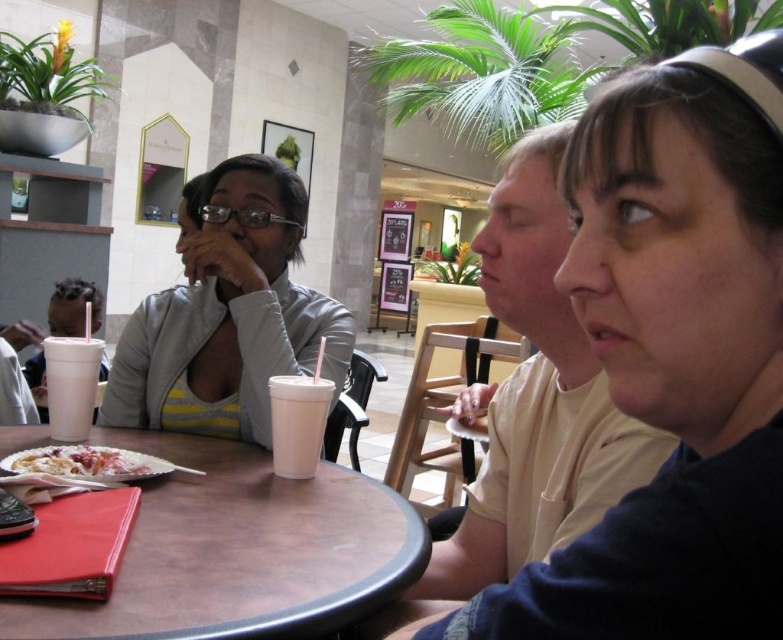
You are a server at the cafe and need to place a new dessert order on the table. The dessert is as wide as the white creamy dessert at table center. Will it fit on the brown laminate table at lower left without overlapping the edges?

The brown laminate table at lower left is wider than the white creamy dessert at table center, so the new dessert will fit on the brown laminate table at lower left without overlapping the edges.

You are sitting at the brown laminate table at lower left and want to reach the white matte cup at table left. Based on the scene description, which direction should you move to get it?

The brown laminate table at lower left is to the right of the white matte cup at table left, so you should move to your left to reach the white matte cup at table left.

You are a customer at a cafe and want to place your phone on the brown laminate table at lower left without blocking the white creamy dessert at table center. Is the table surface below the dessert large enough to accommodate your phone?

The brown laminate table at lower left is located below the white creamy dessert at table center, so there should be enough space on the table surface below the dessert to place your phone without blocking it.